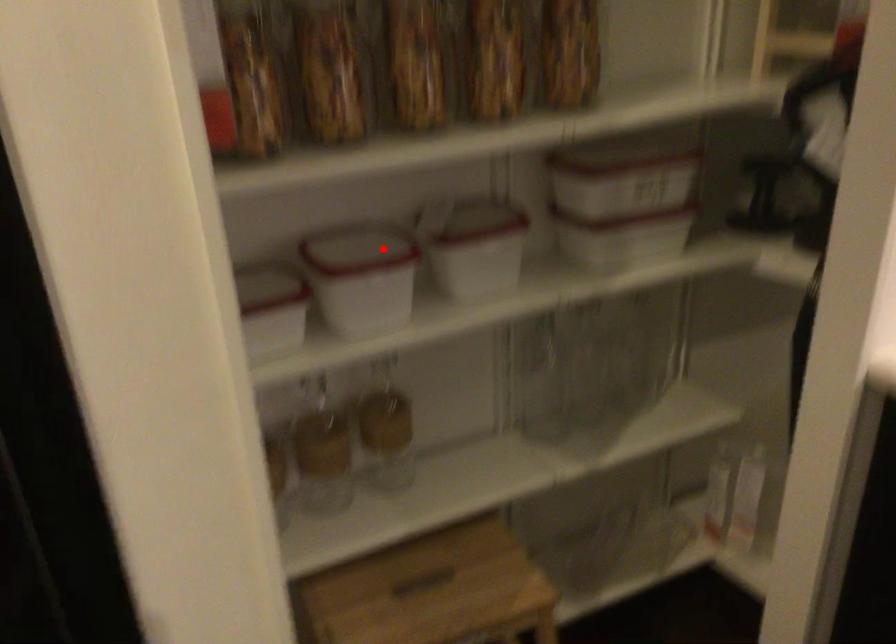
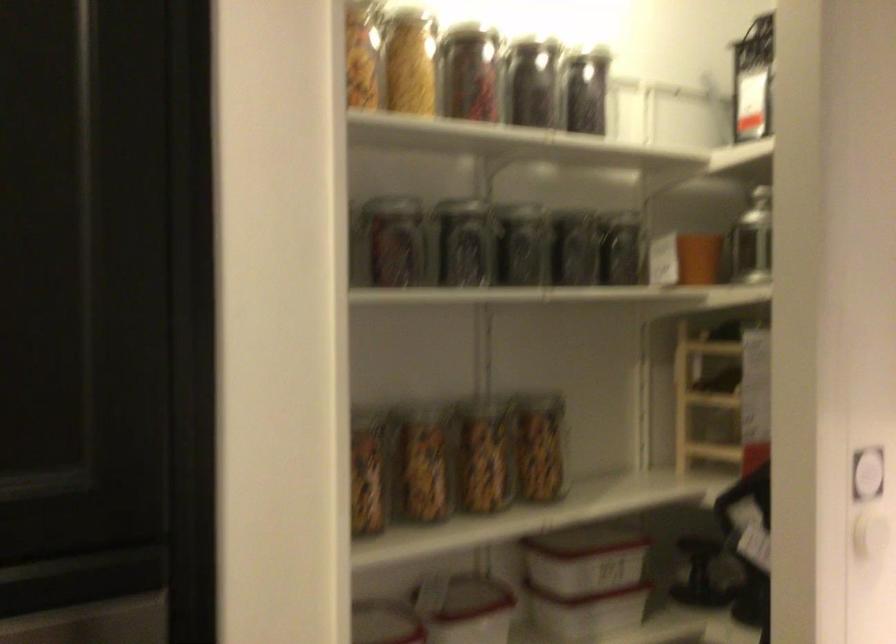
Locate, in the second image, the point that corresponds to the highlighted location in the first image.

(383, 623)